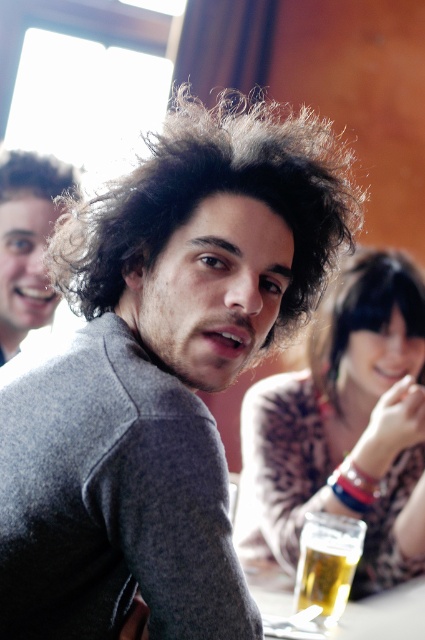
You are a photographer trying to capture a group photo. You notice two people in the background with matte black hair at upper left and dark curly hair at upper left. Which person has hair that appears larger in the photo?

The matte black hair at upper left appears larger in the photo than the dark curly hair at upper left.